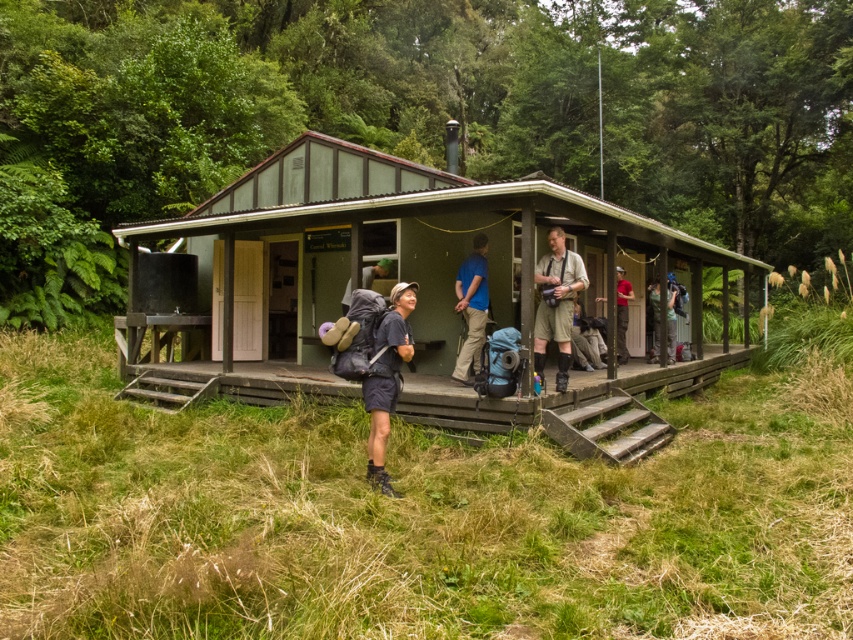
Looking at this image, does wooden porch at center have a greater height compared to red cotton shirt at center?

No.

This screenshot has height=640, width=853. I want to click on wooden porch at center, so click(x=573, y=408).

Between green corrugated metal shed at center and matte gray backpack at center, which one has more height?

green corrugated metal shed at center is taller.

Between green corrugated metal shed at center and matte gray backpack at center, which one appears on the left side from the viewer's perspective?

Positioned to the left is matte gray backpack at center.

Image resolution: width=853 pixels, height=640 pixels. Describe the element at coordinates (401, 275) in the screenshot. I see `green corrugated metal shed at center` at that location.

Where is `green corrugated metal shed at center`? green corrugated metal shed at center is located at coordinates (401, 275).

Does matte black backpack at center have a greater height compared to blue fabric backpack at center?

No.

Locate an element on the screen. The image size is (853, 640). matte black backpack at center is located at coordinates (387, 378).